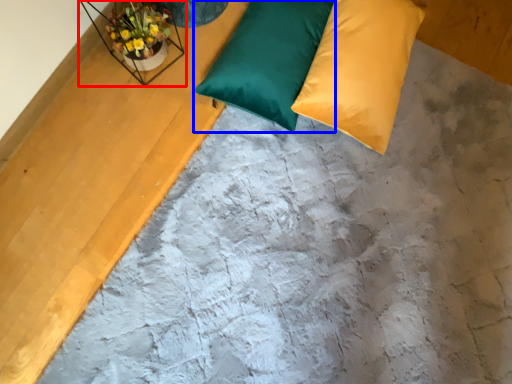
Question: Which of the following is the farthest to the observer, window sill (highlighted by a red box) or pillow (highlighted by a blue box)?

Choices:
 (A) window sill
 (B) pillow

Answer: (B)